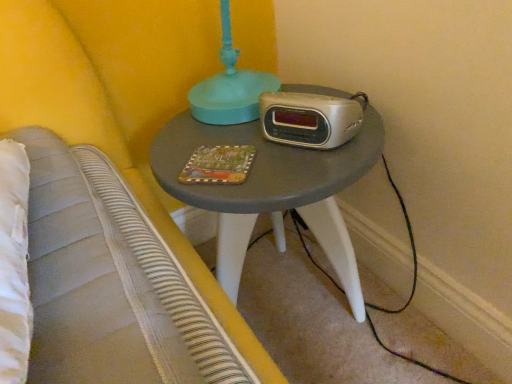
Image resolution: width=512 pixels, height=384 pixels. I want to click on blank space above matte gray table at center (from a real-world perspective), so click(x=243, y=142).